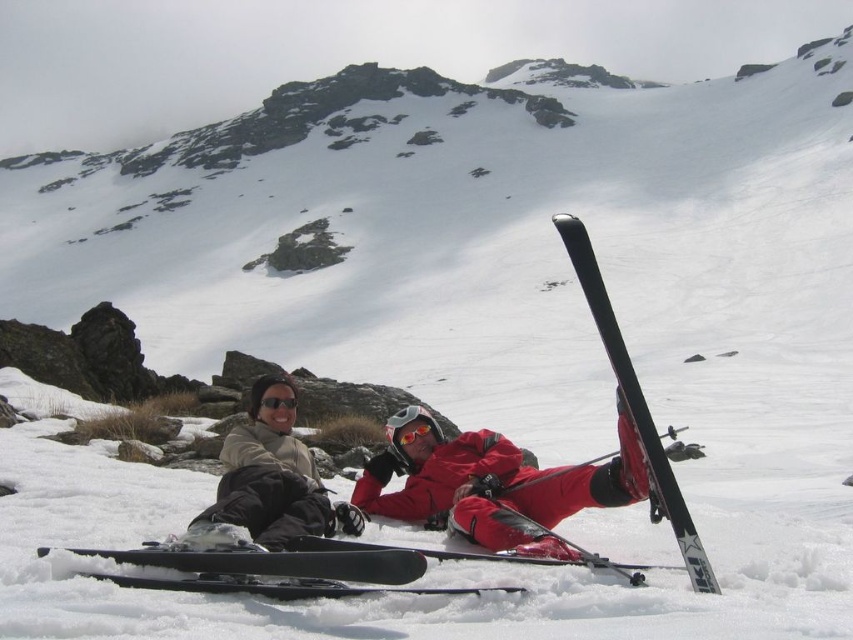
You are a photographer standing at the camera position. You want to capture a closeup shot of the glossy orange goggles at center. Considering your current position, can you estimate whether you need to move closer or farther away to achieve a closeup without zooming?

The glossy orange goggles at center is 49.26 meters away from camera. To capture a closeup without zooming, you would need to move closer to the goggles since they are currently 49.26 meters away, which is too far for a closeup shot.

Looking at this image, you are a photographer positioned at point (412,429) in the winter scene. You want to capture a closeup shot of the glossy orange goggles at center. Which direction should you move to ensure the goggles remain in the center of your frame?

The glossy orange goggles at center are already positioned at point (412,429), so you should stay at that point to keep them centered in your frame.

You are planning to place a rectangular object that is 1.2 meters long on the snowy slope where the matte beige jacket at center and the black matte ski at lower center are located. Considering their sizes, which object would you choose to place the rectangle on top of to ensure it fits without overhanging?

The black matte ski at lower center has a greater width than the matte beige jacket at center, so placing the rectangular object on top of the black matte ski at lower center would ensure it fits without overhanging.